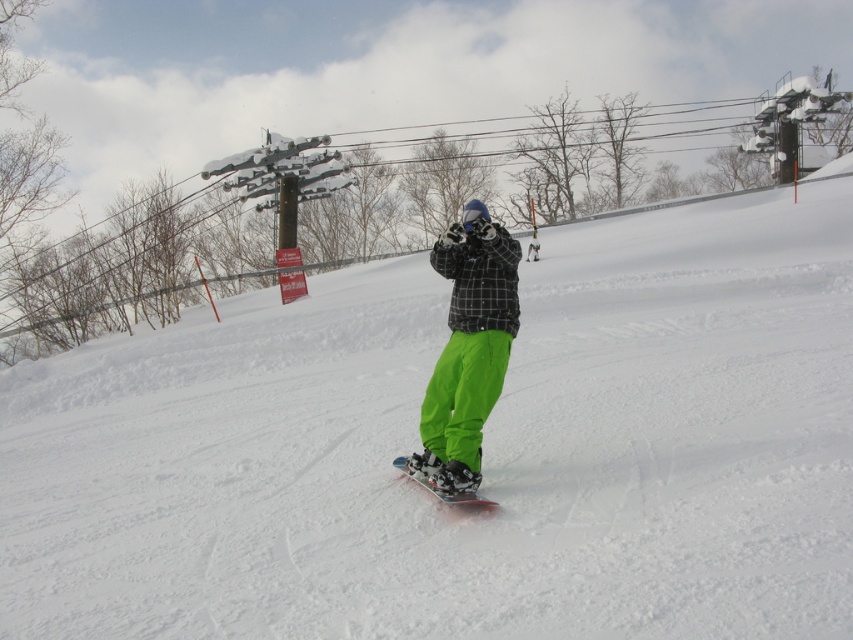
Question: Considering the relative positions of neon green pants at center and black matte snowboard at center in the image provided, where is neon green pants at center located with respect to black matte snowboard at center?

Choices:
 (A) below
 (B) above

Answer: (B)

Question: Which object appears closest to the camera in this image?

Choices:
 (A) neon green pants at center
 (B) black matte snowboard at center

Answer: (B)

Question: Is neon green pants at center below black matte snowboard at center?

Choices:
 (A) no
 (B) yes

Answer: (A)

Question: Does neon green pants at center appear on the left side of black matte snowboard at center?

Choices:
 (A) yes
 (B) no

Answer: (B)

Question: Which object is closer to the camera taking this photo?

Choices:
 (A) neon green pants at center
 (B) black matte snowboard at center

Answer: (B)